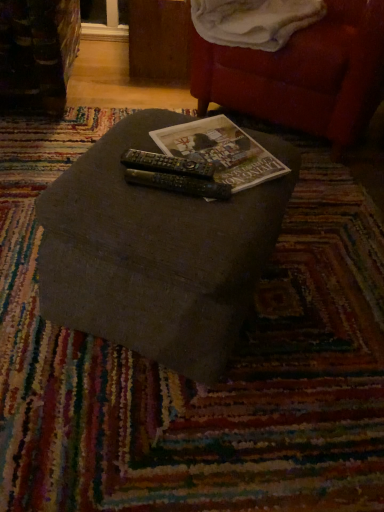
Question: Is black plastic remote at center, the 2th remote viewed from the front, spatially inside textured gray ottoman at center, or outside of it?

Choices:
 (A) inside
 (B) outside

Answer: (A)

Question: From the image's perspective, is black plastic remote at center, the 2th remote viewed from the front, above or below textured gray ottoman at center?

Choices:
 (A) below
 (B) above

Answer: (B)

Question: Which of these objects is positioned closest to the matte paper book at center?

Choices:
 (A) black plastic remote at center, the 1th remote in the back-to-front sequence
 (B) white soft blanket at upper right
 (C) black plastic remote at center, acting as the second remote starting from the back
 (D) textured gray ottoman at center
 (E) velvet red bean bag chair at upper right

Answer: (A)

Question: Which object is positioned farthest from the white soft blanket at upper right?

Choices:
 (A) velvet red bean bag chair at upper right
 (B) matte paper book at center
 (C) black plastic remote at center, arranged as the first remote when viewed from the front
 (D) textured gray ottoman at center
 (E) black plastic remote at center, the 1th remote in the back-to-front sequence

Answer: (C)